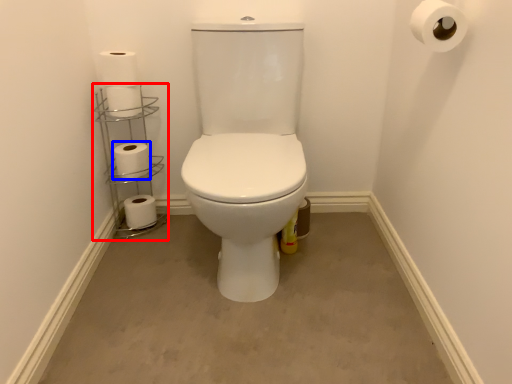
Question: Which point is closer to the camera, shelf (highlighted by a red box) or toilet paper (highlighted by a blue box)?

Choices:
 (A) shelf
 (B) toilet paper

Answer: (A)